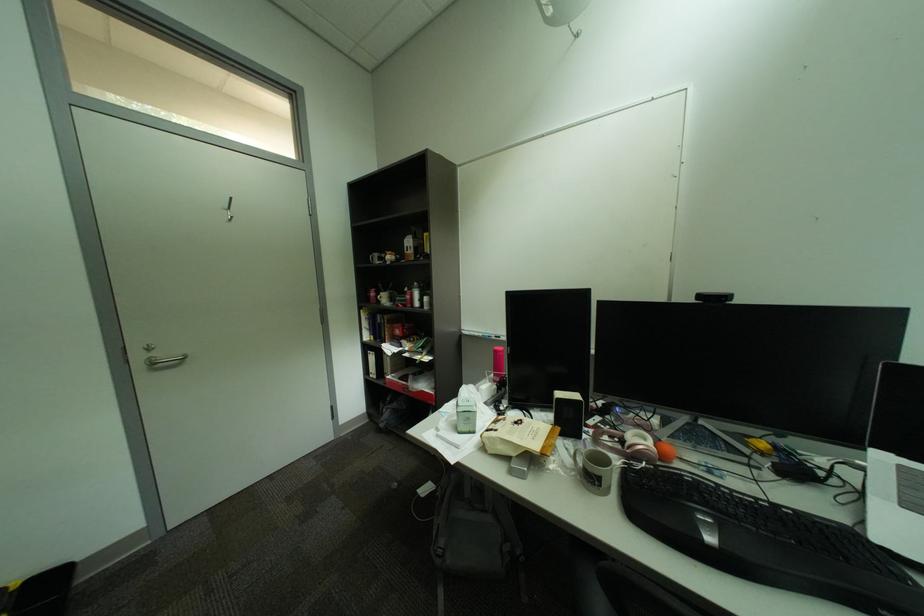
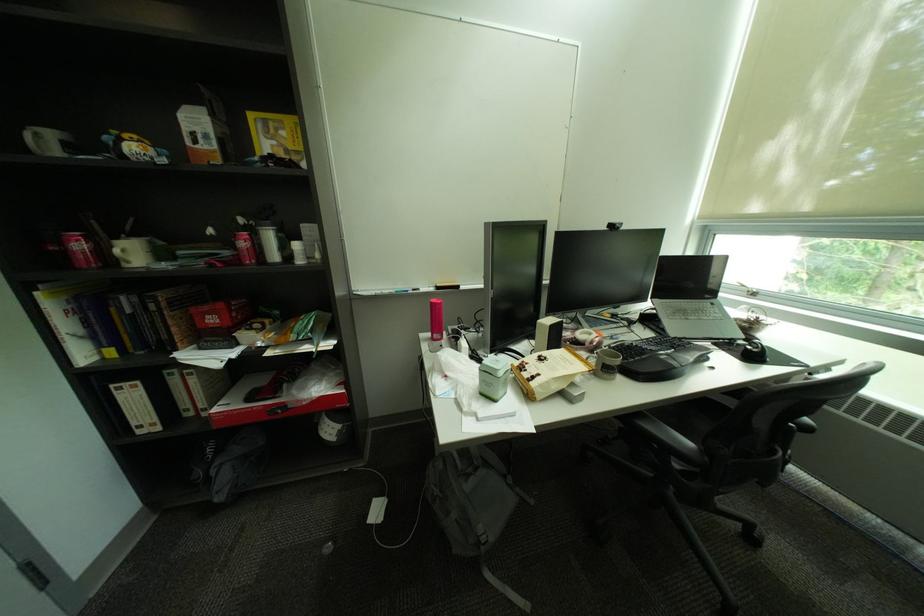
Locate, in the second image, the point that corresponds to pixel 711 299 in the first image.

(621, 227)